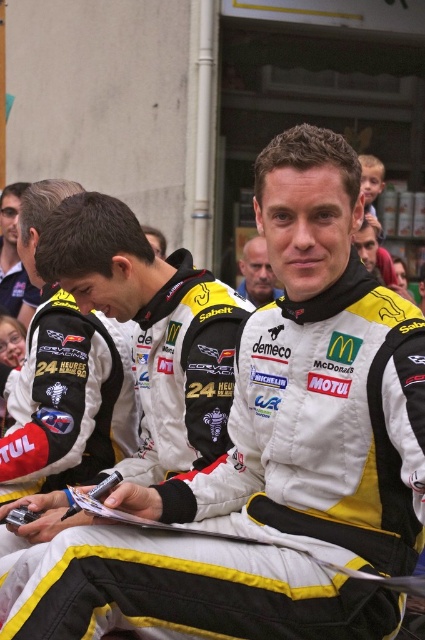
Who is positioned more to the right, matte black helmet at upper left or white leather jacket at center?

white leather jacket at center is more to the right.

Which is above, matte black helmet at upper left or white leather jacket at center?

matte black helmet at upper left is higher up.

Is point (14, 284) more distant than point (265, 262)?

Yes, it is behind point (265, 262).

In order to click on matte black helmet at upper left in this screenshot , I will do `click(14, 259)`.